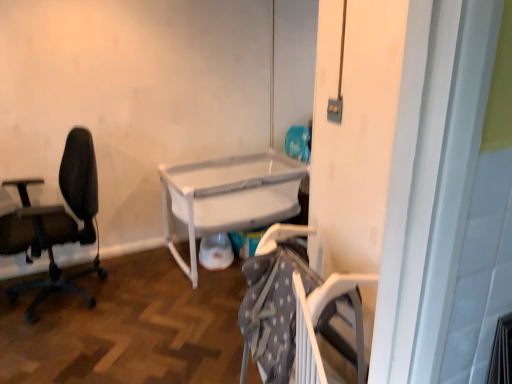
Question: Is white plastic crib at center to the right of white plastic screen door at center from the viewer's perspective?

Choices:
 (A) yes
 (B) no

Answer: (B)

Question: Does white plastic crib at center appear on the left side of white plastic screen door at center?

Choices:
 (A) no
 (B) yes

Answer: (B)

Question: Is white plastic screen door at center a part of white plastic crib at center?

Choices:
 (A) no
 (B) yes

Answer: (A)

Question: Does white plastic crib at center have a greater height compared to white plastic screen door at center?

Choices:
 (A) no
 (B) yes

Answer: (A)

Question: Does white plastic crib at center have a smaller size compared to white plastic screen door at center?

Choices:
 (A) yes
 (B) no

Answer: (B)

Question: Is the position of white plastic crib at center less distant than that of white plastic screen door at center?

Choices:
 (A) no
 (B) yes

Answer: (A)

Question: From the image's perspective, is black mesh office chair at left on white plastic screen door at center?

Choices:
 (A) yes
 (B) no

Answer: (A)

Question: Are black mesh office chair at left and white plastic screen door at center beside each other?

Choices:
 (A) no
 (B) yes

Answer: (A)

Question: Is black mesh office chair at left in front of white plastic screen door at center?

Choices:
 (A) yes
 (B) no

Answer: (B)

Question: Are black mesh office chair at left and white plastic screen door at center far apart?

Choices:
 (A) yes
 (B) no

Answer: (A)

Question: Is black mesh office chair at left shorter than white plastic screen door at center?

Choices:
 (A) no
 (B) yes

Answer: (B)

Question: From a real-world perspective, is black mesh office chair at left below white plastic screen door at center?

Choices:
 (A) yes
 (B) no

Answer: (A)

Question: Is black mesh office chair at left thinner than white plastic crib at center?

Choices:
 (A) no
 (B) yes

Answer: (B)